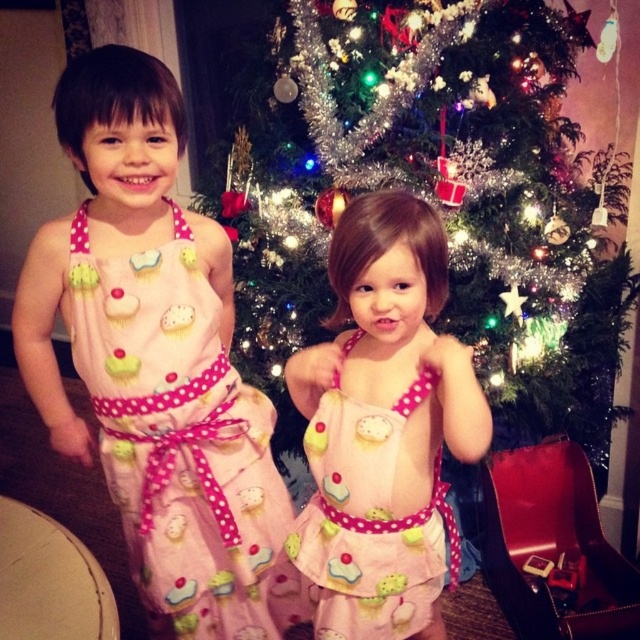
Does shiny tinsel christmas tree at center have a larger size compared to pink polka dot fabric dress at center?

Yes, shiny tinsel christmas tree at center is bigger than pink polka dot fabric dress at center.

Does shiny tinsel christmas tree at center appear over pink polka dot fabric dress at center?

Correct, shiny tinsel christmas tree at center is located above pink polka dot fabric dress at center.

Between point (396, 176) and point (240, 472), which one is positioned behind?

Point (396, 176)

Identify the location of shiny tinsel christmas tree at center. (420, 192).

Which is above, pink polka dot fabric dress at center or pink polka dot dress at center?

pink polka dot dress at center is higher up.

Does pink polka dot fabric dress at center have a greater height compared to pink polka dot dress at center?

Yes, pink polka dot fabric dress at center is taller than pink polka dot dress at center.

Who is more forward, (273, 412) or (372, 214)?

Point (372, 214) is in front.

At what (x,y) coordinates should I click in order to perform the action: click on pink polka dot fabric dress at center. Please return your answer as a coordinate pair (x, y). The image size is (640, 640). Looking at the image, I should click on (182, 442).

Which of these two, shiny tinsel christmas tree at center or pink polka dot dress at center, stands taller?

Standing taller between the two is shiny tinsel christmas tree at center.

Does point (358, 52) come behind point (397, 588)?

That is True.

This screenshot has height=640, width=640. Find the location of `shiny tinsel christmas tree at center`. shiny tinsel christmas tree at center is located at coordinates (420, 192).